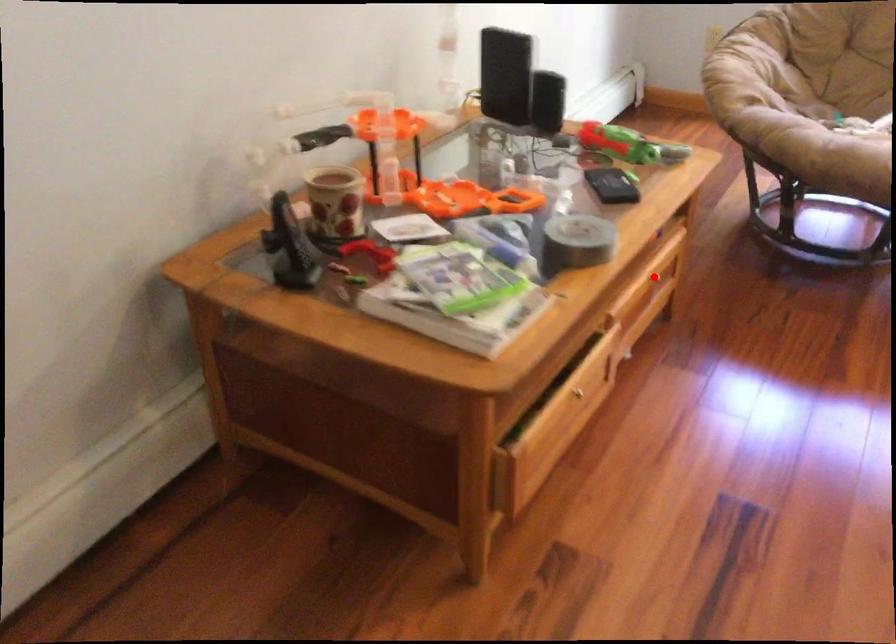
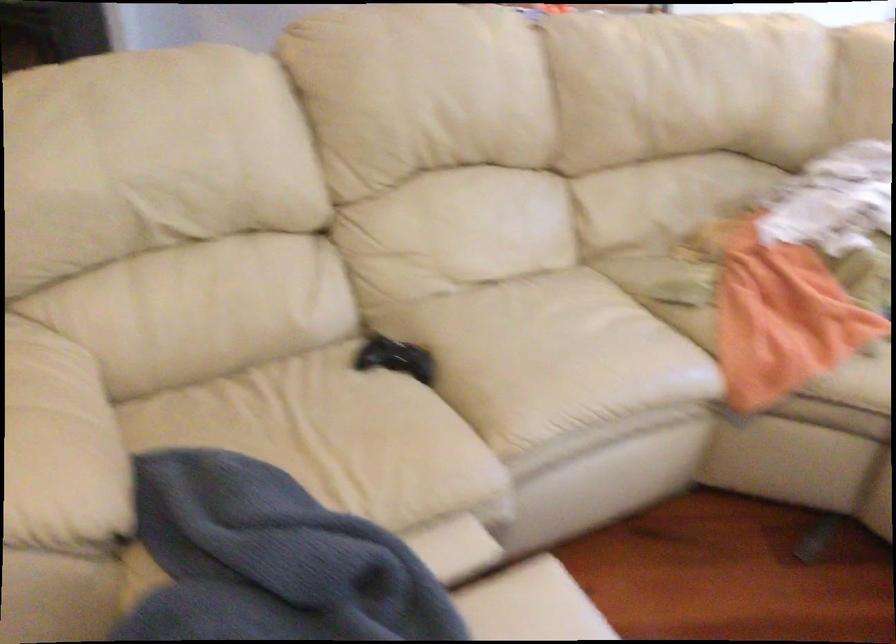
Question: I am providing you with two images of the same scene from different viewpoints. A red point is marked on the first image. Is the red point's position out of view in image 2?

Choices:
 (A) Yes
 (B) No

Answer: (A)